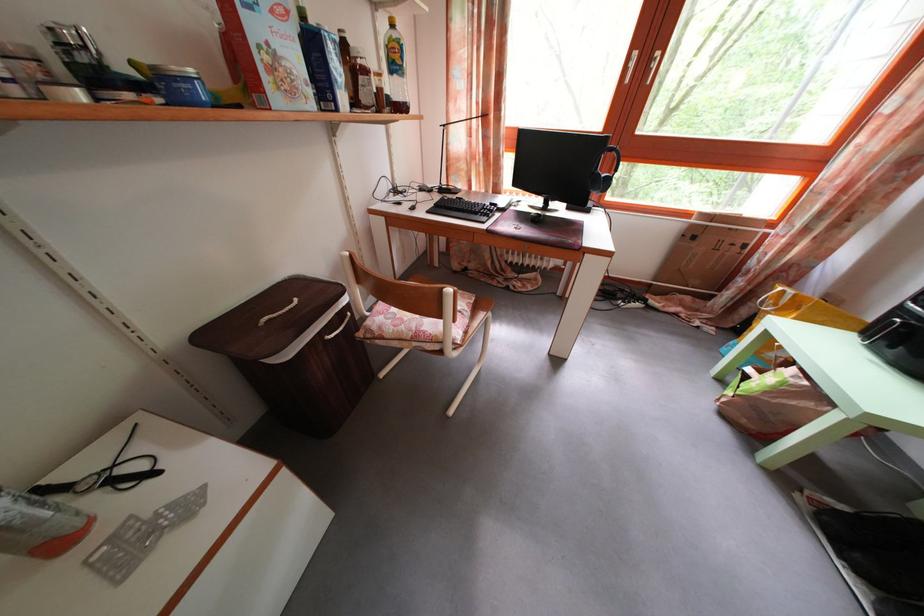
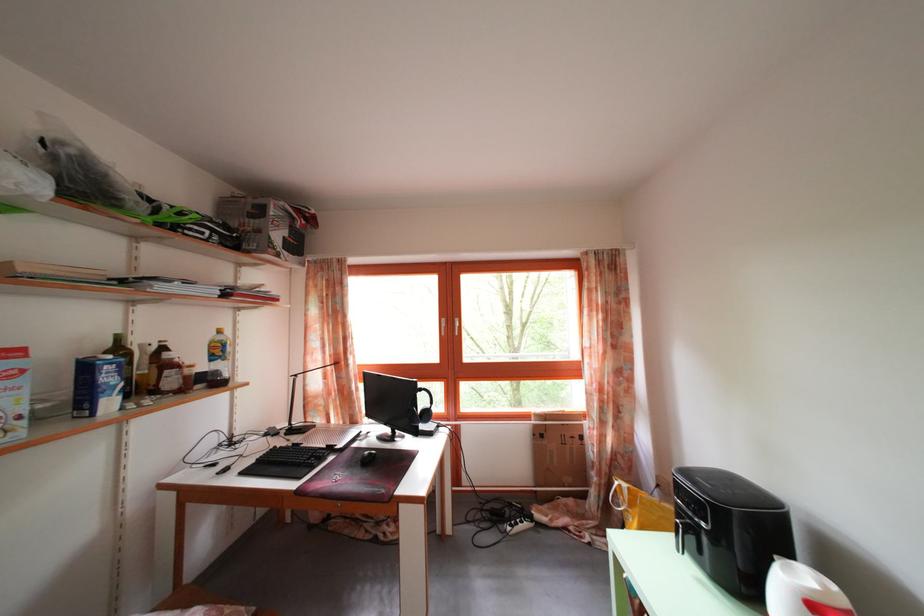
The point at (x=483, y=220) is marked in the first image. Where is the corresponding point in the second image?

(307, 472)